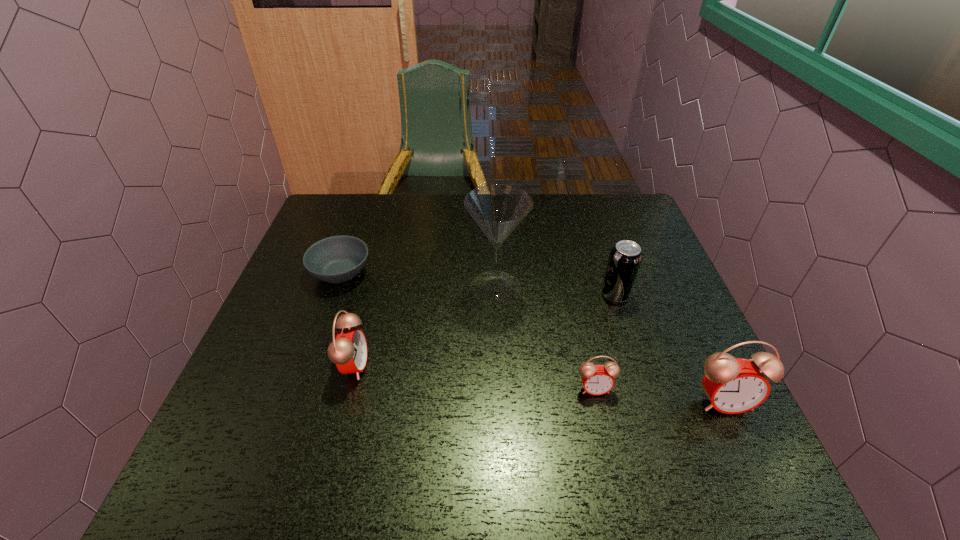
Locate an element on the screen. This screenshot has height=540, width=960. free space between the leftmost alarm clock and the rightmost object is located at coordinates (539, 383).

The image size is (960, 540). In order to click on vacant region between the soda can and the rightmost alarm clock in this screenshot , I will do `click(669, 348)`.

What are the coordinates of `object that is the second closest to the second alarm clock from right to left` in the screenshot? It's located at (498, 209).

Identify which object is the second nearest to the rightmost object. Please provide its 2D coordinates. Your answer should be formatted as a tuple, i.e. [(x, y)], where the tuple contains the x and y coordinates of a point satisfying the conditions above.

[(625, 258)]

Image resolution: width=960 pixels, height=540 pixels. Identify the location of the closest alarm clock to the flute glass. (597, 379).

Locate which alarm clock is the closest to the second alarm clock from left to right. Please provide its 2D coordinates. Your answer should be formatted as a tuple, i.e. [(x, y)], where the tuple contains the x and y coordinates of a point satisfying the conditions above.

[(733, 385)]

This screenshot has width=960, height=540. Identify the location of free space in the image that satisfies the following two spatial constraints: 1. on the front side of the fifth object from left to right; 2. on the clock face of the leftmost alarm clock. (638, 365).